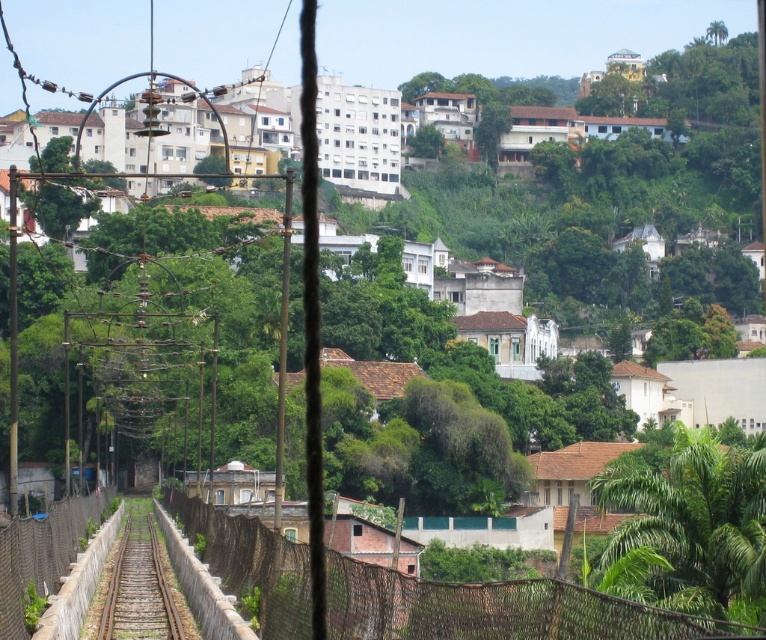
Question: Which object is farther from the camera taking this photo?

Choices:
 (A) green leafy tree at lower right
 (B) brown gravel train track at center

Answer: (B)

Question: Does green leafy tree at lower right appear under brown gravel train track at center?

Choices:
 (A) yes
 (B) no

Answer: (B)

Question: Does green leafy tree at lower right appear on the right side of brown gravel train track at center?

Choices:
 (A) yes
 (B) no

Answer: (A)

Question: Is green leafy tree at lower right in front of brown gravel train track at center?

Choices:
 (A) yes
 (B) no

Answer: (A)

Question: Which point is farther from the camera taking this photo?

Choices:
 (A) (146, 612)
 (B) (722, 522)

Answer: (A)